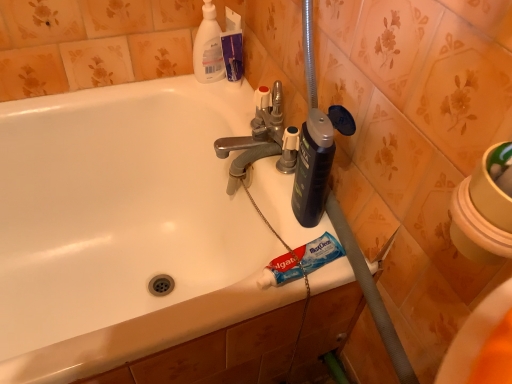
Identify the location of blank space to the left of white plastic bottle at upper center. The height and width of the screenshot is (384, 512). (151, 85).